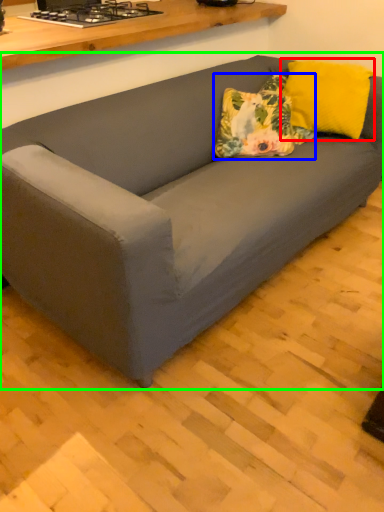
Question: Estimate the real-world distances between objects in this image. Which object is closer to pillow (highlighted by a red box), throw pillow (highlighted by a blue box) or studio couch (highlighted by a green box)?

Choices:
 (A) throw pillow
 (B) studio couch

Answer: (A)